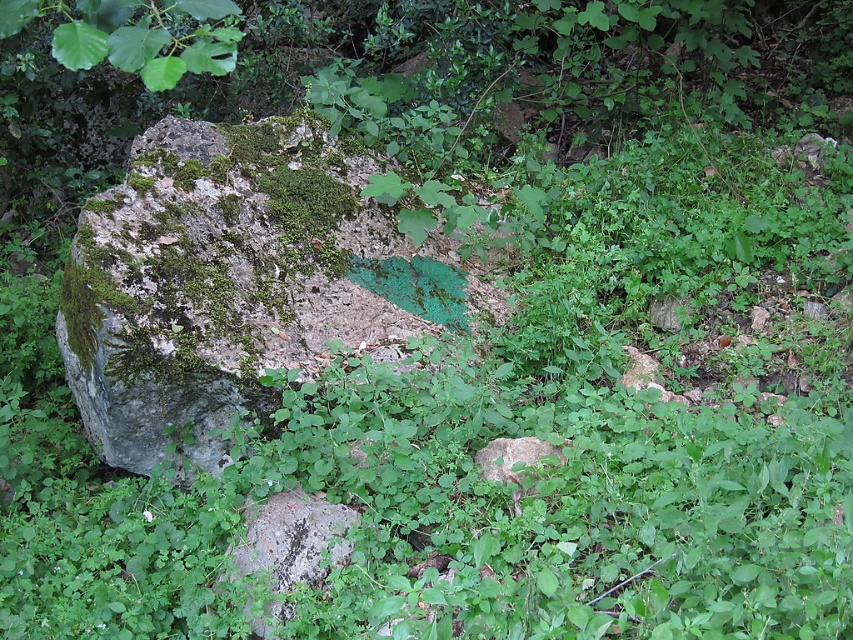
Based on the photo, who is shorter, mossy rock at center or speckled gray rock at center?

With less height is speckled gray rock at center.

Locate an element on the screen. The image size is (853, 640). mossy rock at center is located at coordinates (235, 284).

Identify the location of mossy rock at center. The width and height of the screenshot is (853, 640). (235, 284).